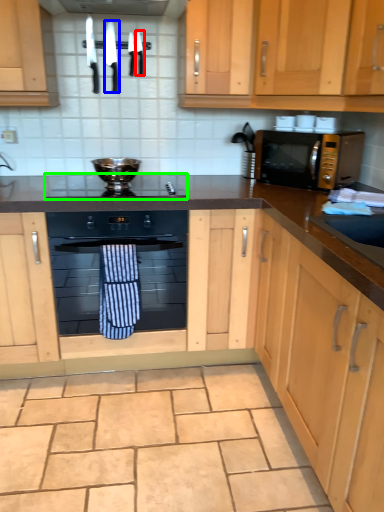
Question: Which is farther away from knife (highlighted by a red box)? knife (highlighted by a blue box) or gas stove (highlighted by a green box)?

Choices:
 (A) knife
 (B) gas stove

Answer: (B)